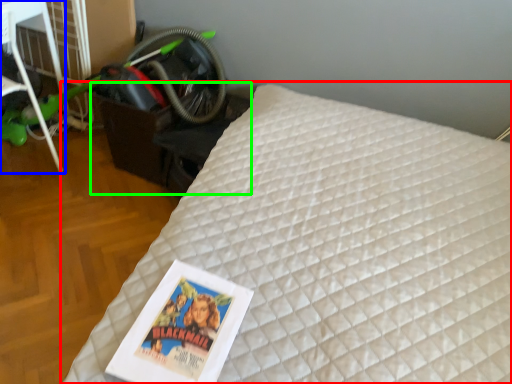
Question: Estimate the real-world distances between objects in this image. Which object is closer to bed (highlighted by a red box), furniture (highlighted by a blue box) or table (highlighted by a green box)?

Choices:
 (A) furniture
 (B) table

Answer: (B)